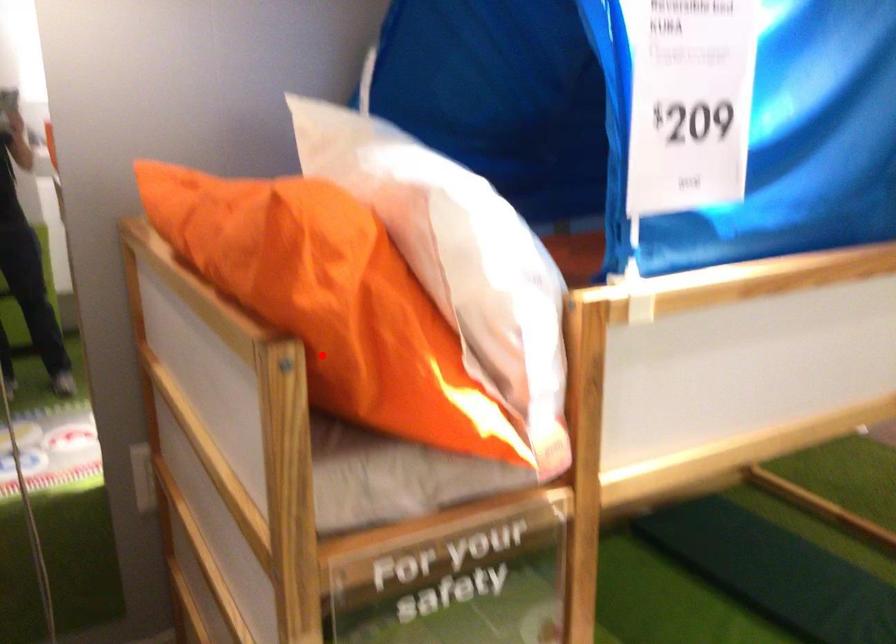
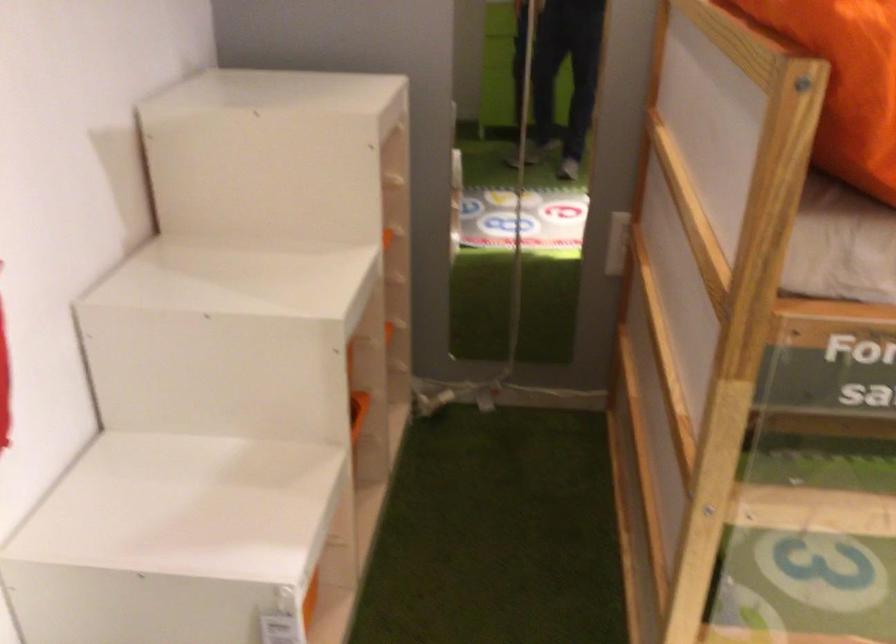
Question: I am providing you with two images of the same scene from different viewpoints. Given a red point in image1, look at the same physical point in image2. Is it:

Choices:
 (A) Closer to the viewpoint
 (B) Farther from the viewpoint

Answer: (A)